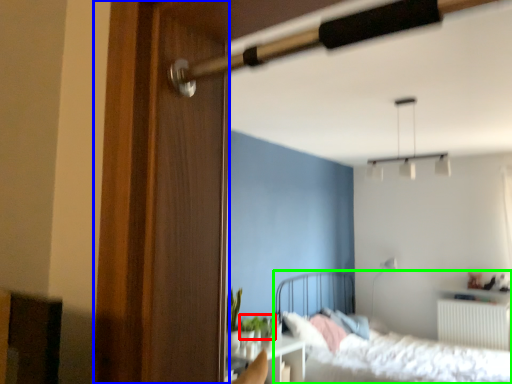
Question: Estimate the real-world distances between objects in this image. Which object is closer to plant (highlighted by a red box), screen door (highlighted by a blue box) or bed (highlighted by a green box)?

Choices:
 (A) screen door
 (B) bed

Answer: (B)